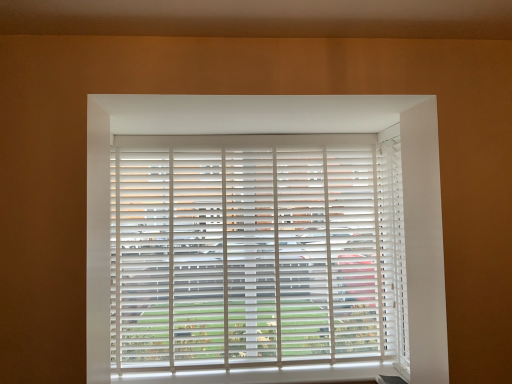
Question: Does white matte blinds at right have a greater width compared to white matte blinds at center?

Choices:
 (A) yes
 (B) no

Answer: (B)

Question: Can you confirm if white matte blinds at right is bigger than white matte blinds at center?

Choices:
 (A) yes
 (B) no

Answer: (B)

Question: Does white matte blinds at right lie in front of white matte blinds at center?

Choices:
 (A) yes
 (B) no

Answer: (A)

Question: Does white matte blinds at right turn towards white matte blinds at center?

Choices:
 (A) yes
 (B) no

Answer: (A)

Question: Would you consider white matte blinds at right to be distant from white matte blinds at center?

Choices:
 (A) yes
 (B) no

Answer: (B)

Question: Is white matte blinds at right oriented away from white matte blinds at center?

Choices:
 (A) no
 (B) yes

Answer: (A)

Question: Is white matte blinds at center oriented towards white matte blinds at right?

Choices:
 (A) no
 (B) yes

Answer: (B)

Question: Is white matte blinds at center to the left of white matte blinds at right from the viewer's perspective?

Choices:
 (A) no
 (B) yes

Answer: (B)

Question: Are white matte blinds at center and white matte blinds at right beside each other?

Choices:
 (A) yes
 (B) no

Answer: (B)

Question: Is white matte blinds at right completely or partially inside white matte blinds at center?

Choices:
 (A) yes
 (B) no

Answer: (B)

Question: From the image's perspective, is white matte blinds at center below white matte blinds at right?

Choices:
 (A) no
 (B) yes

Answer: (B)

Question: Considering the relative sizes of white matte blinds at center and white matte blinds at right in the image provided, is white matte blinds at center taller than white matte blinds at right?

Choices:
 (A) yes
 (B) no

Answer: (B)

Question: Considering the positions of point (399, 218) and point (248, 281), is point (399, 218) closer or farther from the camera than point (248, 281)?

Choices:
 (A) farther
 (B) closer

Answer: (B)